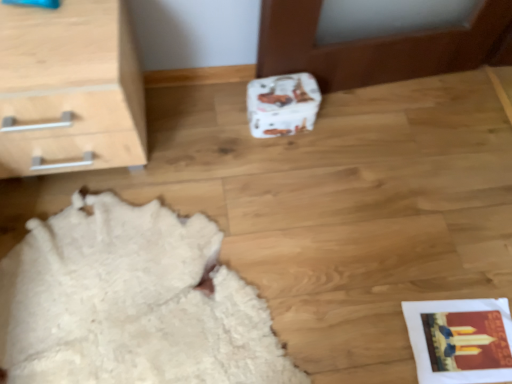
Identify the location of vacant area that lies between light wood/texture chest of drawers at upper left and white fluffy rug at lower left. (178, 137).